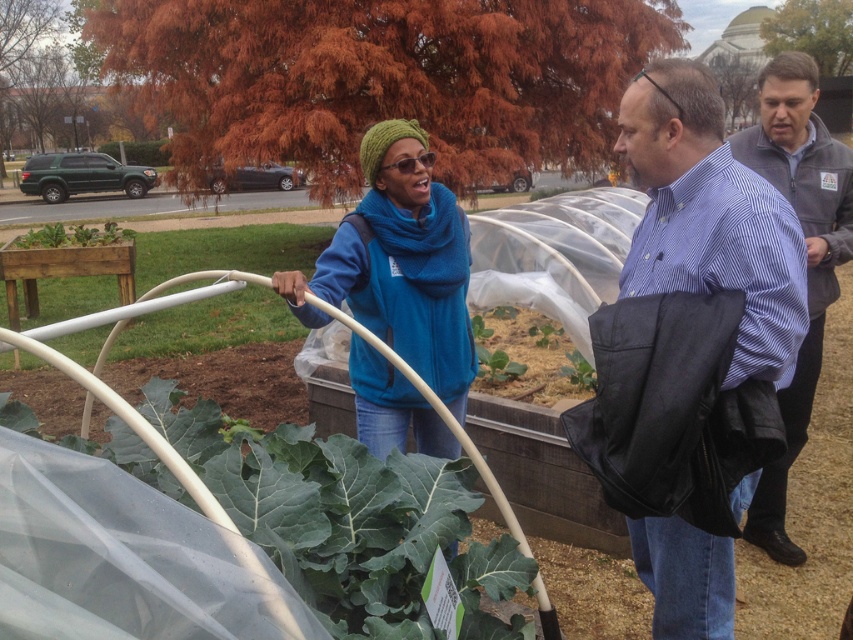
You are a photographer trying to capture a detailed shot of the green leafy plant at lower left. You notice the blue fleece jacket at center is blocking part of the plant. Based on their sizes, can you estimate if moving the jacket slightly to the right would allow you to see the entire plant?

The blue fleece jacket at center is thinner than the green leafy plant at lower left. Moving the jacket slightly to the right might not fully reveal the plant since the plant is wider. You may need to move further back or adjust your angle.

You are a photographer trying to capture a photo of the matte blue shirt at center and the green leafy plant at lower left. Which object should you focus on first if you want to ensure both are in the frame without moving the camera?

The matte blue shirt at center is larger in size than the green leafy plant at lower left, so you should focus on the matte blue shirt at center first to ensure it fits within the frame before adjusting for the smaller plant.

You are a photographer trying to capture a photo of the matte blue shirt at center and the green leafy plant at lower left. Which object should you focus on first if you want to ensure both are in focus without adjusting the camera settings?

The matte blue shirt at center is thinner than the green leafy plant at lower left, so you should focus on the green leafy plant at lower left first since it has a larger size and depth of field would require focusing on the larger object to ensure both are in focus.